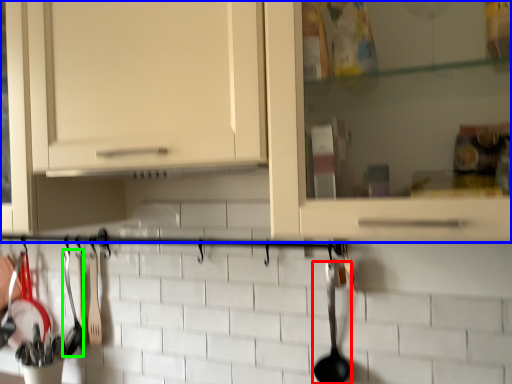
Question: Based on their relative distances, which object is farther from silverware (highlighted by a red box)? Choose from cabinetry (highlighted by a blue box) and silverware (highlighted by a green box).

Choices:
 (A) cabinetry
 (B) silverware

Answer: (B)